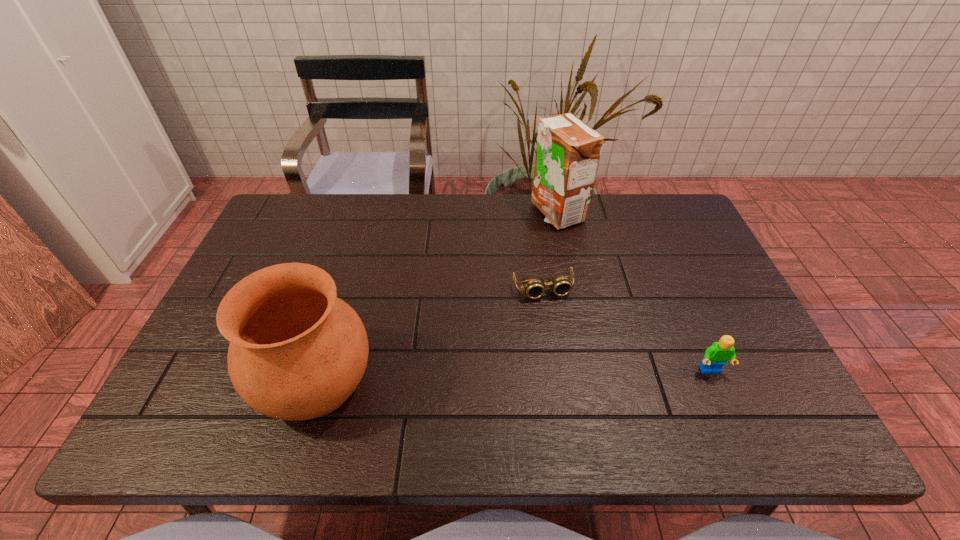
Find the location of a particular element. The width and height of the screenshot is (960, 540). free space on the desktop that is between the pottery and the second shortest object and is positioned on the straw side of the farthest object is located at coordinates (469, 378).

This screenshot has width=960, height=540. Find the location of `vacant space on the desktop that is between the pottery and the Lego and is positioned through the lenses of the shortest object`. vacant space on the desktop that is between the pottery and the Lego and is positioned through the lenses of the shortest object is located at coordinates (571, 375).